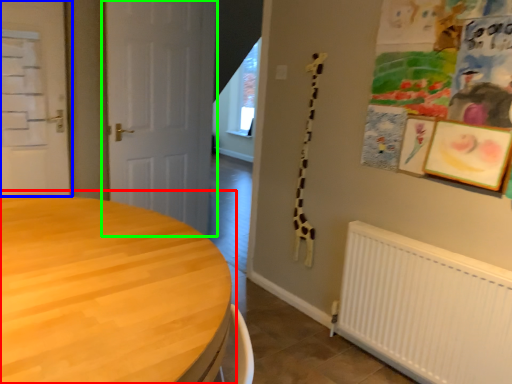
Question: Based on their relative distances, which object is farther from table (highlighted by a red box)? Choose from door (highlighted by a blue box) and door (highlighted by a green box).

Choices:
 (A) door
 (B) door

Answer: (A)